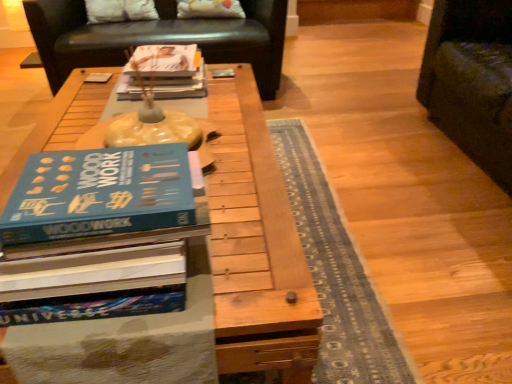
I want to click on unoccupied region to the right of matte paper book at center, so click(230, 90).